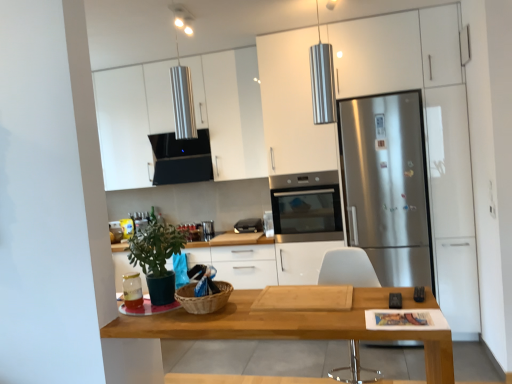
This screenshot has width=512, height=384. Describe the element at coordinates (306, 207) in the screenshot. I see `stainless steel oven at center` at that location.

Where is `woven brown basket at center`? The width and height of the screenshot is (512, 384). woven brown basket at center is located at coordinates (203, 298).

Measure the distance between point (139,286) and camera.

7.06 feet.

The width and height of the screenshot is (512, 384). What do you see at coordinates (249, 225) in the screenshot?
I see `black plastic toaster at center, the second appliance viewed from the left` at bounding box center [249, 225].

Locate an element on the screen. stainless steel oven at center is located at coordinates (306, 207).

Between black plastic toaster at center, the 3th appliance ordered from the bottom, and black matte exhaust hood at upper center, which one has smaller width?

black plastic toaster at center, the 3th appliance ordered from the bottom, is thinner.

Is black plastic toaster at center, marked as the third appliance in a front-to-back arrangement, further to the viewer compared to black matte exhaust hood at upper center?

Yes, it is.

In the scene shown: Considering the sizes of black plastic toaster at center, arranged as the 1th appliance when viewed from the top, and black matte exhaust hood at upper center in the image, is black plastic toaster at center, arranged as the 1th appliance when viewed from the top, bigger or smaller than black matte exhaust hood at upper center?

Clearly, black plastic toaster at center, arranged as the 1th appliance when viewed from the top, is smaller in size than black matte exhaust hood at upper center.

Could you tell me if black plastic toaster at center, which ranks as the first appliance in back-to-front order, is turned towards black matte exhaust hood at upper center?

No, black plastic toaster at center, which ranks as the first appliance in back-to-front order, does not turn towards black matte exhaust hood at upper center.

From the image's perspective, between black matte exhaust hood at upper center and stainless steel oven at center, which one is located above?

black matte exhaust hood at upper center is shown above in the image.

Is black matte exhaust hood at upper center facing away from stainless steel oven at center?

That's not correct — black matte exhaust hood at upper center is not looking away from stainless steel oven at center.

Is point (209, 140) closer to camera compared to point (274, 180)?

Yes, it is.

Between black matte exhaust hood at upper center and stainless steel oven at center, which one has more height?

stainless steel oven at center.

Which of these two, woven brown basket at center or stainless steel refrigerator at right, is bigger?

stainless steel refrigerator at right is bigger.

Is woven brown basket at center next to stainless steel refrigerator at right?

No, woven brown basket at center is not beside stainless steel refrigerator at right.

Which is nearer, [204,297] or [404,137]?

Clearly, point [204,297] is closer to the camera than point [404,137].

From the image's perspective, which is below, woven brown basket at center or stainless steel refrigerator at right?

From the image's view, woven brown basket at center is below.

Is green matte plant at lower left directly adjacent to stainless steel refrigerator at right?

No.

From the image's perspective, which is above, green matte plant at lower left or stainless steel refrigerator at right?

stainless steel refrigerator at right, from the image's perspective.

Looking at this image, is green matte plant at lower left to the left of stainless steel refrigerator at right from the viewer's perspective?

Indeed, green matte plant at lower left is positioned on the left side of stainless steel refrigerator at right.

Which point is more forward, (154, 215) or (374, 189)?

The point (154, 215) is in front.

Considering the positions of objects black matte exhaust hood at upper center and green matte plant at lower left in the image provided, who is behind, black matte exhaust hood at upper center or green matte plant at lower left?

black matte exhaust hood at upper center is more distant.

Does black matte exhaust hood at upper center turn towards green matte plant at lower left?

Yes, black matte exhaust hood at upper center is aimed at green matte plant at lower left.

From the image's perspective, is black matte exhaust hood at upper center on top of green matte plant at lower left?

Yes, from the image's perspective, black matte exhaust hood at upper center is above green matte plant at lower left.

Is black matte exhaust hood at upper center to the left of green matte plant at lower left from the viewer's perspective?

Yes.

Considering the positions of points (340, 201) and (339, 148), is point (340, 201) closer to camera compared to point (339, 148)?

That is False.

In terms of height, does stainless steel oven at center look taller or shorter compared to stainless steel refrigerator at right?

In the image, stainless steel oven at center appears to be shorter than stainless steel refrigerator at right.

Could stainless steel refrigerator at right be considered to be inside stainless steel oven at center?

That's incorrect, stainless steel refrigerator at right is not inside stainless steel oven at center.

Can you confirm if stainless steel oven at center is thinner than stainless steel refrigerator at right?

Correct, the width of stainless steel oven at center is less than that of stainless steel refrigerator at right.

This screenshot has height=384, width=512. Identify the location of the 3rd appliance behind the wooden table at center, counting from the anchor's position. (249, 225).

Can you confirm if black plastic toaster at center, the 3th appliance ordered from the bottom, is bigger than wooden table at center?

Actually, black plastic toaster at center, the 3th appliance ordered from the bottom, might be smaller than wooden table at center.

Between black plastic toaster at center, the second appliance viewed from the left, and wooden table at center, which one has smaller width?

black plastic toaster at center, the second appliance viewed from the left.

From the picture: Based on their positions, is black plastic toaster at center, the 3th appliance ordered from the bottom, located to the left or right of wooden table at center?

From the image, it's evident that black plastic toaster at center, the 3th appliance ordered from the bottom, is to the left of wooden table at center.

This screenshot has width=512, height=384. I want to click on exhaust hood that is in front of the black plastic toaster at center, which is counted as the 2th appliance, starting from the right, so click(181, 158).

Locate an element on the screen. The width and height of the screenshot is (512, 384). kitchen appliance that appears below the black matte exhaust hood at upper center (from the image's perspective) is located at coordinates (306, 207).

From the image, which object appears to be farther from white glossy cabinet at upper center, green matte plant at lower left or black plastic toaster at center, marked as the third appliance in a front-to-back arrangement?

green matte plant at lower left lies further to white glossy cabinet at upper center than the other object.

Looking at the image, which one is located closer to wooden table at center, stainless steel oven at center or white plastic chair at center?

white plastic chair at center.

Estimate the real-world distances between objects in this image. Which object is closer to green matte plant at lower left, stainless steel refrigerator at right or black plastic toaster at center, the second appliance viewed from the left?

stainless steel refrigerator at right is closer to green matte plant at lower left.

Which object lies further to the anchor point black plastic toaster at center, the 3th appliance ordered from the bottom, black matte exhaust hood at upper center or wooden table at center?

wooden table at center lies further to black plastic toaster at center, the 3th appliance ordered from the bottom, than the other object.

Which object lies further to the anchor point matte glass jar at lower left, placed as the second appliance when sorted from front to back, black plastic remote control at lower center, marked as the 2th appliance in a bottom-to-top arrangement, or black matte exhaust hood at upper center?

black matte exhaust hood at upper center lies further to matte glass jar at lower left, placed as the second appliance when sorted from front to back, than the other object.

From the image, which object appears to be nearer to black matte exhaust hood at upper center, woven brown basket at center or white plastic chair at center?

Based on the image, white plastic chair at center appears to be nearer to black matte exhaust hood at upper center.

Which object lies further to the anchor point white glossy cabinet at upper center, wooden table at center or black matte exhaust hood at upper center?

wooden table at center is positioned further to the anchor white glossy cabinet at upper center.

Based on their spatial positions, is matte glass jar at lower left, acting as the 3th appliance starting from the right, or white glossy cabinet at upper center closer to stainless steel oven at center?

white glossy cabinet at upper center is positioned closer to the anchor stainless steel oven at center.

I want to click on chair between woven brown basket at center and stainless steel refrigerator at right along the z-axis, so click(x=347, y=268).

Where is `chair positioned between green matte plant at lower left and stainless steel oven at center from near to far`? Image resolution: width=512 pixels, height=384 pixels. chair positioned between green matte plant at lower left and stainless steel oven at center from near to far is located at coordinates (347, 268).

I want to click on chair located between woven brown basket at center and black plastic toaster at center, the 3th appliance ordered from the bottom, in the depth direction, so click(x=347, y=268).

In order to click on houseplant positioned between wooden table at center and black plastic toaster at center, which is counted as the 2th appliance, starting from the right, from near to far in this screenshot , I will do `click(157, 258)`.